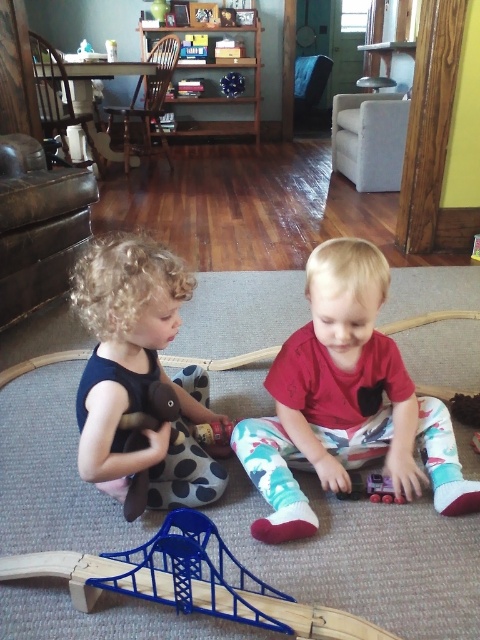
Can you confirm if red matte toy car at center is positioned above soft black dress at left?

Incorrect, red matte toy car at center is not positioned above soft black dress at left.

Which is behind, point (337, 486) or point (123, 276)?

The point (337, 486) is more distant.

I want to click on red matte toy car at center, so click(346, 403).

Does red matte toy car at center appear over rubberized plastic train at center?

Yes.

The image size is (480, 640). In order to click on red matte toy car at center in this screenshot , I will do `click(346, 403)`.

You are a GUI agent. You are given a task and a screenshot of the screen. Output one action in this format:
    pyautogui.click(x=<x>, y=<y>)
    Task: Click on the red matte toy car at center
    
    Given the screenshot: What is the action you would take?
    pyautogui.click(x=346, y=403)

In the scene shown: Can you confirm if soft black dress at left is positioned to the left of rubberized plastic train at center?

Indeed, soft black dress at left is positioned on the left side of rubberized plastic train at center.

Who is more distant from viewer, (x=143, y=401) or (x=362, y=474)?

The point (x=362, y=474) is more distant.

This screenshot has height=640, width=480. I want to click on soft black dress at left, so click(x=139, y=371).